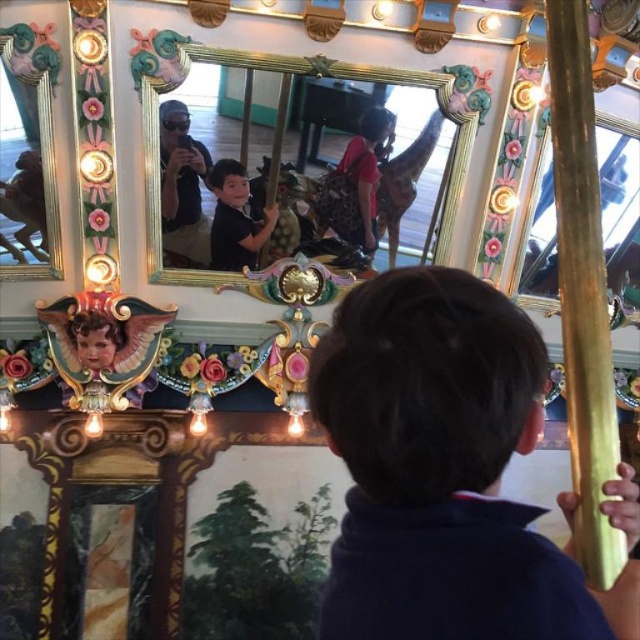
Does gold/gilded mirror at upper center have a lesser height compared to matte black shirt at center?

No.

This screenshot has height=640, width=640. What do you see at coordinates (284, 131) in the screenshot? I see `gold/gilded mirror at upper center` at bounding box center [284, 131].

At what (x,y) coordinates should I click in order to perform the action: click on gold/gilded mirror at upper center. Please return your answer as a coordinate pair (x, y). Looking at the image, I should click on (284, 131).

Between dark brown hair at center and gold/gilded mirror at upper center, which one is positioned higher?

gold/gilded mirror at upper center is above.

Who is more distant from viewer, (532, 376) or (465, 124)?

Point (465, 124)

You are a GUI agent. You are given a task and a screenshot of the screen. Output one action in this format:
    pyautogui.click(x=<x>, y=<y>)
    Task: Click on the dark brown hair at center
    This screenshot has width=640, height=640.
    Given the screenshot: What is the action you would take?
    pyautogui.click(x=438, y=467)

What do you see at coordinates (236, 220) in the screenshot? I see `matte black shirt at center` at bounding box center [236, 220].

Is point (234, 262) positioned after point (12, 268)?

Yes, point (234, 262) is farther from viewer.

The image size is (640, 640). What are the coordinates of `matte black shirt at center` in the screenshot? It's located at (236, 220).